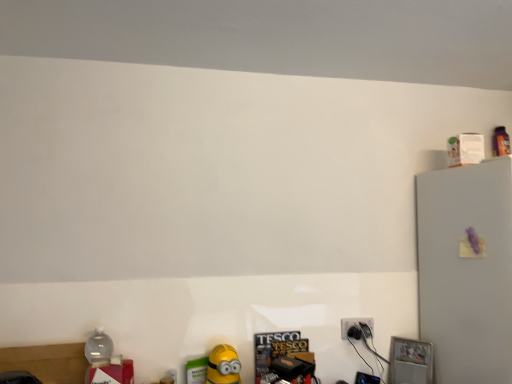
This screenshot has width=512, height=384. What do you see at coordinates (99, 349) in the screenshot?
I see `transparent plastic bottle at lower left` at bounding box center [99, 349].

Describe the element at coordinates (466, 271) in the screenshot. I see `white matte refrigerator at upper right` at that location.

At what (x,y) coordinates should I click in order to perform the action: click on white matte refrigerator at upper right. Please return your answer as a coordinate pair (x, y). This screenshot has width=512, height=384. Looking at the image, I should click on (x=466, y=271).

Image resolution: width=512 pixels, height=384 pixels. What do you see at coordinates (223, 365) in the screenshot? I see `yellow matte toy at lower center` at bounding box center [223, 365].

Identify the location of transparent plastic bottle at lower left. The width and height of the screenshot is (512, 384). (99, 349).

Could you measure the distance between black plastic power plugs and sockets at lower right and white matte refrigerator at upper right?

They are 48.39 centimeters apart.

From the image's perspective, would you say black plastic power plugs and sockets at lower right is positioned over white matte refrigerator at upper right?

No, from the image's perspective, black plastic power plugs and sockets at lower right is not above white matte refrigerator at upper right.

Which is behind, black plastic power plugs and sockets at lower right or white matte refrigerator at upper right?

black plastic power plugs and sockets at lower right is further from the camera.

Is black plastic power plugs and sockets at lower right thinner than white matte refrigerator at upper right?

Indeed, black plastic power plugs and sockets at lower right has a lesser width compared to white matte refrigerator at upper right.

Considering the sizes of objects white matte refrigerator at upper right and yellow matte toy at lower center in the image provided, who is smaller, white matte refrigerator at upper right or yellow matte toy at lower center?

yellow matte toy at lower center is smaller.

From the image's perspective, is white matte refrigerator at upper right located above or below yellow matte toy at lower center?

white matte refrigerator at upper right is situated higher than yellow matte toy at lower center in the image.

Is white matte refrigerator at upper right oriented towards yellow matte toy at lower center?

No, white matte refrigerator at upper right is not aimed at yellow matte toy at lower center.

Is white matte refrigerator at upper right located outside transparent plastic bottle at lower left?

Yes, white matte refrigerator at upper right is located beyond the bounds of transparent plastic bottle at lower left.

In the scene shown: Which object is closer to the camera taking this photo, white matte refrigerator at upper right or transparent plastic bottle at lower left?

white matte refrigerator at upper right is in front.

Can you confirm if white matte refrigerator at upper right is positioned to the right of transparent plastic bottle at lower left?

Yes, white matte refrigerator at upper right is to the right of transparent plastic bottle at lower left.

Does point (464, 190) come in front of point (98, 333)?

Yes, point (464, 190) is closer to viewer.

From a real-world perspective, who is located lower, transparent plastic bottle at lower left or yellow matte toy at lower center?

yellow matte toy at lower center.

Is transparent plastic bottle at lower left smaller than yellow matte toy at lower center?

Yes, transparent plastic bottle at lower left is smaller than yellow matte toy at lower center.

Is transparent plastic bottle at lower left behind yellow matte toy at lower center?

That is False.

In order to click on bottle on the left of yellow matte toy at lower center in this screenshot , I will do `click(99, 349)`.

From the image's perspective, which is above, yellow matte toy at lower center or transparent plastic bottle at lower left?

transparent plastic bottle at lower left is shown above in the image.

Considering the points (216, 379) and (104, 336), which point is in front, point (216, 379) or point (104, 336)?

The point (216, 379) is closer.

Identify the location of toy that is behind the transparent plastic bottle at lower left. The height and width of the screenshot is (384, 512). (223, 365).

Is transparent plastic bottle at lower left a part of yellow matte toy at lower center?

No, transparent plastic bottle at lower left is not inside yellow matte toy at lower center.

Is yellow matte toy at lower center aimed at white matte refrigerator at upper right?

No, yellow matte toy at lower center is not facing towards white matte refrigerator at upper right.

Does yellow matte toy at lower center have a greater width compared to white matte refrigerator at upper right?

In fact, yellow matte toy at lower center might be narrower than white matte refrigerator at upper right.

Which point is more distant from viewer, (239, 362) or (422, 217)?

Point (422, 217)

How distant is yellow matte toy at lower center from white matte refrigerator at upper right?

yellow matte toy at lower center and white matte refrigerator at upper right are 94.22 centimeters apart.

Is black plastic power plugs and sockets at lower right touching yellow matte toy at lower center?

They are not placed beside each other.

From the image's perspective, is black plastic power plugs and sockets at lower right located above yellow matte toy at lower center?

Correct, black plastic power plugs and sockets at lower right appears higher than yellow matte toy at lower center in the image.

Does point (357, 320) lie behind point (239, 375)?

That is True.

From a real-world perspective, which object rests below the other?

yellow matte toy at lower center is physically lower.

At what (x,y) coordinates should I click in order to perform the action: click on power plugs and sockets that appears on the left of white matte refrigerator at upper right. Please return your answer as a coordinate pair (x, y). This screenshot has width=512, height=384. Looking at the image, I should click on coord(354,323).

Locate an element on the screen. The width and height of the screenshot is (512, 384). fridge in front of the yellow matte toy at lower center is located at coordinates (466, 271).

Considering their positions, is transparent plastic bottle at lower left positioned closer to yellow matte toy at lower center than white matte refrigerator at upper right?

transparent plastic bottle at lower left.

From the picture: Considering their positions, is yellow matte toy at lower center positioned further to white matte refrigerator at upper right than black plastic power plugs and sockets at lower right?

yellow matte toy at lower center is further to white matte refrigerator at upper right.

When comparing their distances from yellow matte toy at lower center, does white matte refrigerator at upper right or transparent plastic bottle at lower left seem closer?

The object closer to yellow matte toy at lower center is transparent plastic bottle at lower left.

Estimate the real-world distances between objects in this image. Which object is further from white matte refrigerator at upper right, black plastic power plugs and sockets at lower right or transparent plastic bottle at lower left?

transparent plastic bottle at lower left is further to white matte refrigerator at upper right.

Considering their positions, is white matte refrigerator at upper right positioned closer to transparent plastic bottle at lower left than yellow matte toy at lower center?

yellow matte toy at lower center is positioned closer to the anchor transparent plastic bottle at lower left.

Based on their spatial positions, is black plastic power plugs and sockets at lower right or transparent plastic bottle at lower left further from yellow matte toy at lower center?

The object further to yellow matte toy at lower center is black plastic power plugs and sockets at lower right.

Based on their spatial positions, is black plastic power plugs and sockets at lower right or yellow matte toy at lower center further from white matte refrigerator at upper right?

The object further to white matte refrigerator at upper right is yellow matte toy at lower center.

Considering their positions, is white matte refrigerator at upper right positioned closer to black plastic power plugs and sockets at lower right than transparent plastic bottle at lower left?

Based on the image, white matte refrigerator at upper right appears to be nearer to black plastic power plugs and sockets at lower right.

Locate an element on the screen. This screenshot has width=512, height=384. toy situated between transparent plastic bottle at lower left and white matte refrigerator at upper right from left to right is located at coordinates (223, 365).

Find the location of `power plugs and sockets located between transparent plastic bottle at lower left and white matte refrigerator at upper right in the left-right direction`. power plugs and sockets located between transparent plastic bottle at lower left and white matte refrigerator at upper right in the left-right direction is located at coordinates (354, 323).

This screenshot has width=512, height=384. I want to click on power plugs and sockets located between yellow matte toy at lower center and white matte refrigerator at upper right in the left-right direction, so click(354, 323).

The height and width of the screenshot is (384, 512). What are the coordinates of `toy situated between transparent plastic bottle at lower left and black plastic power plugs and sockets at lower right from left to right` in the screenshot? It's located at (223, 365).